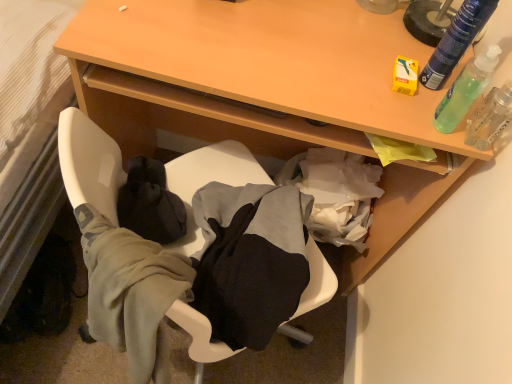
At what (x,y) coordinates should I click in order to perform the action: click on vacant position to the left of green translucent bottle at upper right, the 2th bottle in the top-to-bottom sequence. Please return your answer as a coordinate pair (x, y). Looking at the image, I should click on (365, 87).